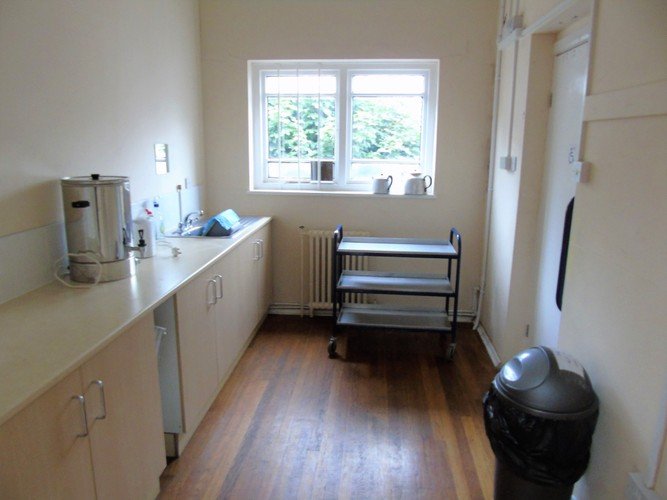
Find the location of a particular element. The height and width of the screenshot is (500, 667). window frame is located at coordinates (257, 84), (434, 103), (344, 65), (344, 188).